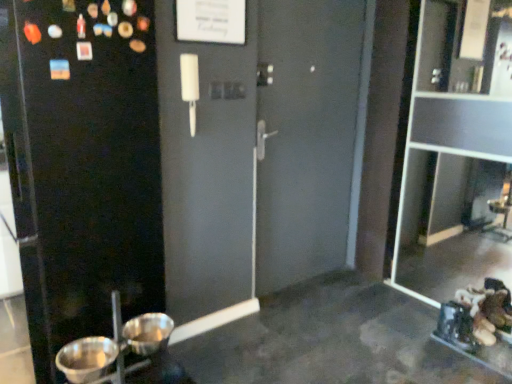
Question: Could you tell me if metallic silver basin at lower left, which appears as the second basin when viewed from the right, is facing transparent glass cabinet at right?

Choices:
 (A) no
 (B) yes

Answer: (A)

Question: Does metallic silver basin at lower left, which appears as the second basin when viewed from the right, appear on the right side of transparent glass cabinet at right?

Choices:
 (A) no
 (B) yes

Answer: (A)

Question: From the image's perspective, is metallic silver basin at lower left, which appears as the second basin when viewed from the right, above transparent glass cabinet at right?

Choices:
 (A) no
 (B) yes

Answer: (A)

Question: Is metallic silver basin at lower left, the first basin positioned from the left, behind transparent glass cabinet at right?

Choices:
 (A) no
 (B) yes

Answer: (A)

Question: Is metallic silver basin at lower left, which appears as the second basin when viewed from the right, with transparent glass cabinet at right?

Choices:
 (A) yes
 (B) no

Answer: (B)

Question: Considering the relative sizes of metallic silver basin at lower left, which appears as the second basin when viewed from the right, and transparent glass cabinet at right in the image provided, is metallic silver basin at lower left, which appears as the second basin when viewed from the right, shorter than transparent glass cabinet at right?

Choices:
 (A) yes
 (B) no

Answer: (A)

Question: Can you confirm if black matte screen door at left is wider than metallic silver basin at lower left, which ranks as the first basin in right-to-left order?

Choices:
 (A) yes
 (B) no

Answer: (A)

Question: Considering the relative positions of black matte screen door at left and metallic silver basin at lower left, the second basin from the left, in the image provided, is black matte screen door at left to the right of metallic silver basin at lower left, the second basin from the left, from the viewer's perspective?

Choices:
 (A) yes
 (B) no

Answer: (B)

Question: From a real-world perspective, is black matte screen door at left positioned under metallic silver basin at lower left, which ranks as the first basin in right-to-left order, based on gravity?

Choices:
 (A) yes
 (B) no

Answer: (B)

Question: Is black matte screen door at left not close to metallic silver basin at lower left, which ranks as the first basin in right-to-left order?

Choices:
 (A) no
 (B) yes

Answer: (A)

Question: Would you say black matte screen door at left is outside metallic silver basin at lower left, the second basin from the left?

Choices:
 (A) no
 (B) yes

Answer: (B)

Question: From the image's perspective, is black matte screen door at left on top of metallic silver basin at lower left, the second basin from the left?

Choices:
 (A) yes
 (B) no

Answer: (A)

Question: Is metallic silver basin at lower left, which ranks as the first basin in right-to-left order, bigger than transparent glass cabinet at right?

Choices:
 (A) yes
 (B) no

Answer: (B)